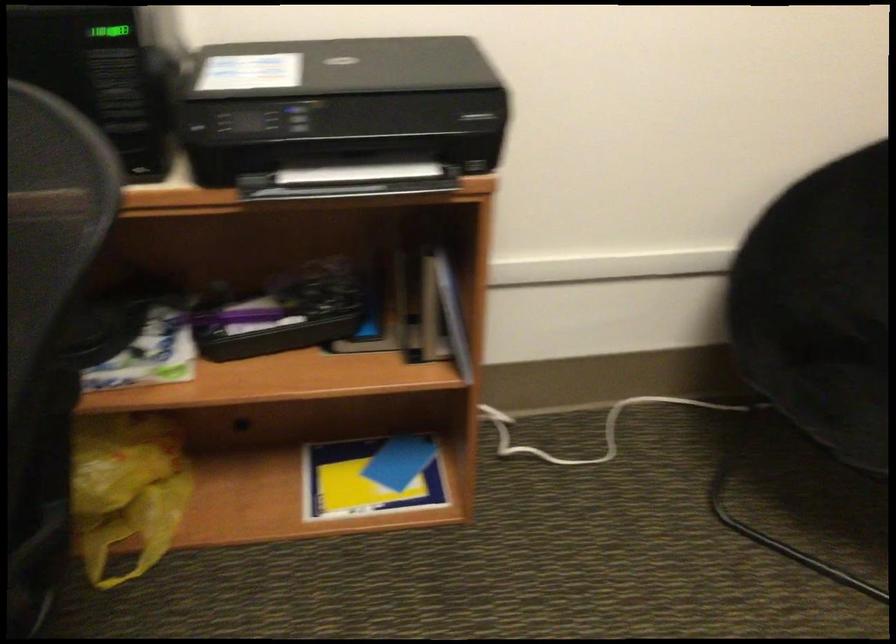
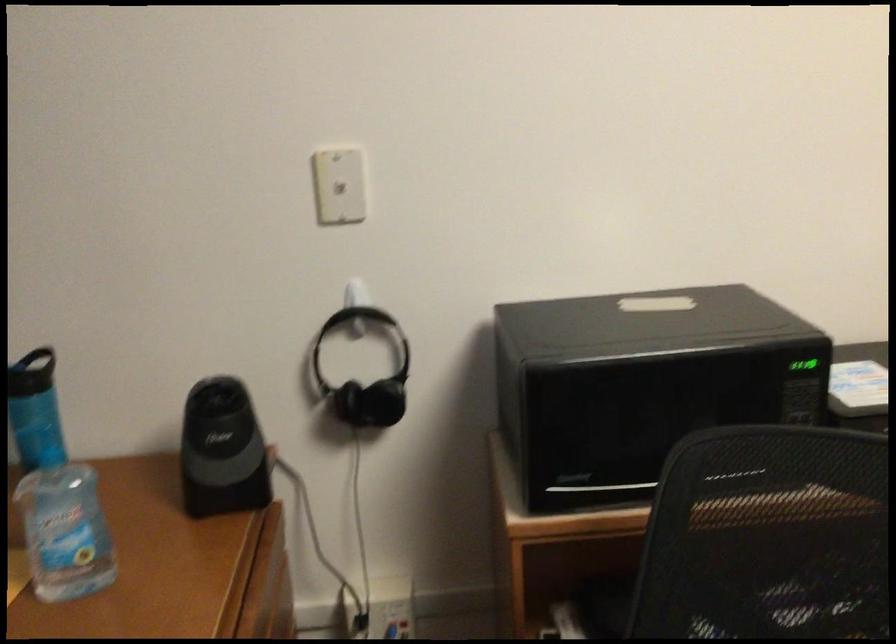
Question: Which direction would the cameraman need to move to produce the second image? Reply with the corresponding letter.

Choices:
 (A) Left
 (B) Right
 (C) Forward
 (D) Backward

Answer: (A)